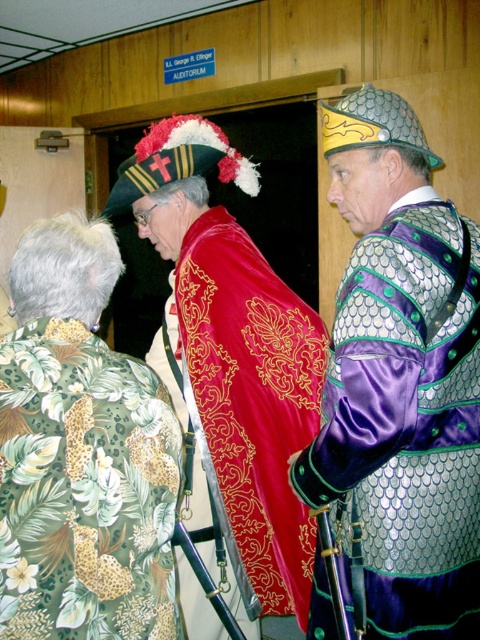
Question: Is green floral shirt at lower left to the left of velvet gold embroidered robe at center from the viewer's perspective?

Choices:
 (A) no
 (B) yes

Answer: (B)

Question: Can you confirm if velvet gold embroidered robe at center is wider than red satin robe at center?

Choices:
 (A) no
 (B) yes

Answer: (B)

Question: Does metallic chainmail armor at right have a greater width compared to red satin robe at center?

Choices:
 (A) yes
 (B) no

Answer: (A)

Question: Which object is closer to the camera taking this photo?

Choices:
 (A) metallic chainmail armor at right
 (B) red satin robe at center
 (C) green floral shirt at lower left

Answer: (C)

Question: Which point is farther from the camera taking this photo?

Choices:
 (A) (371, 144)
 (B) (194, 481)
 (C) (255, 348)
 (D) (55, 481)

Answer: (B)

Question: Which of the following is the closest to the observer?

Choices:
 (A) metallic chainmail armor at right
 (B) red satin robe at center

Answer: (A)